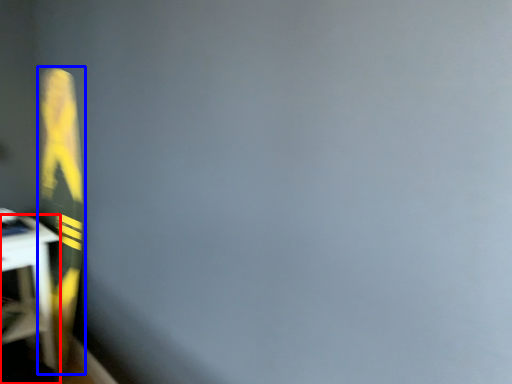
Question: Which object is further to the camera taking this photo, furniture (highlighted by a red box) or bulletin board (highlighted by a blue box)?

Choices:
 (A) furniture
 (B) bulletin board

Answer: (A)